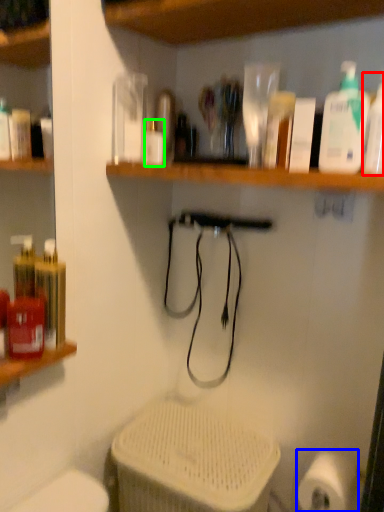
Question: Based on their relative distances, which object is nearer to cleaning product (highlighted by a red box)? Choose from toilet paper (highlighted by a blue box) and bottle (highlighted by a green box).

Choices:
 (A) toilet paper
 (B) bottle

Answer: (B)